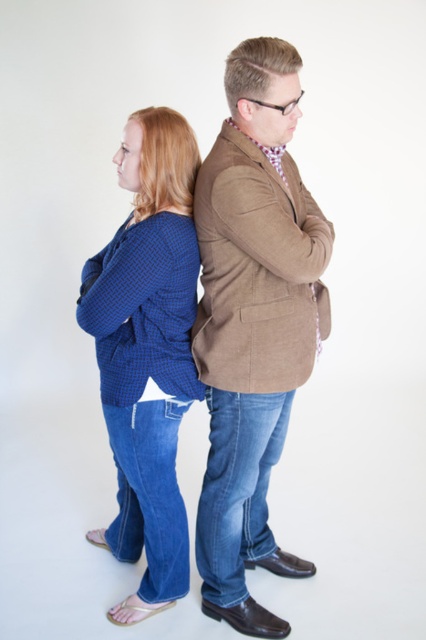
Based on the photo, you are a fashion designer observing the image. You need to locate the blue checkered sweater at center. Where is it positioned in the image?

The blue checkered sweater at center is located at point (146, 352).

You are a tailor trying to fit a customer for a new outfit. You see the blue checkered shirt at center and the blue checkered sweater at center. Which one is narrower in width?

The blue checkered shirt at center has a lesser width compared to the blue checkered sweater at center, so the blue checkered shirt at center is narrower in width.

You are standing in front of the two people in the image. Which of the two points, point (166,580) or point (198,189), is farther away from you?

Point (166,580) is farther away from you because it is behind point (198,189).